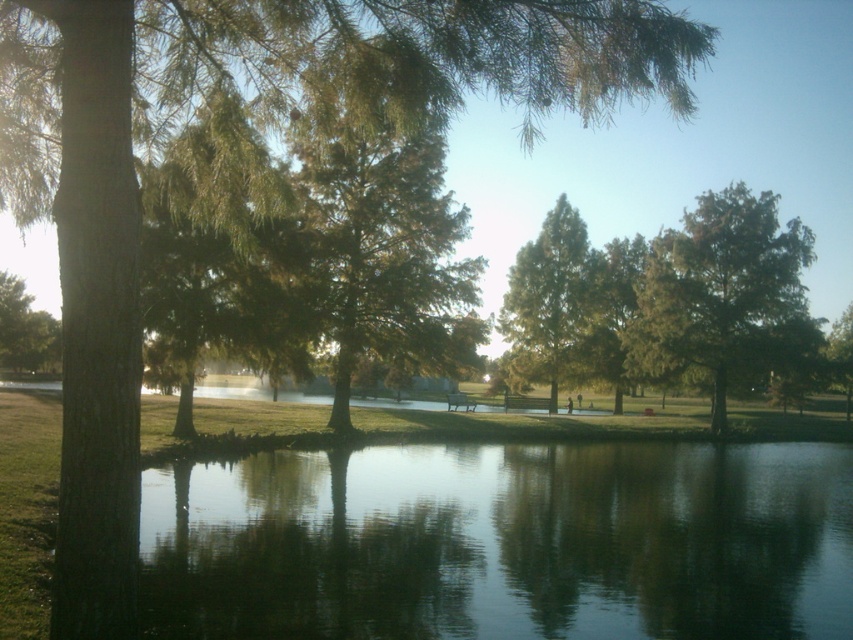
Question: Is green matte tree at center to the left of green leafy tree at left from the viewer's perspective?

Choices:
 (A) yes
 (B) no

Answer: (B)

Question: Is green matte tree at center further to camera compared to green leafy tree at left?

Choices:
 (A) yes
 (B) no

Answer: (A)

Question: Which of the following is the farthest from the observer?

Choices:
 (A) green leafy tree at left
 (B) green matte tree at center
 (C) green reflective water at center
 (D) green leafy tree at upper right

Answer: (B)

Question: Which point is closer to the camera taking this photo?

Choices:
 (A) (234, 579)
 (B) (582, 291)
 (C) (714, 419)

Answer: (A)

Question: Does green reflective water at center have a smaller size compared to green leafy tree at upper right?

Choices:
 (A) yes
 (B) no

Answer: (A)

Question: Which of these objects is positioned closest to the green leafy tree at upper right?

Choices:
 (A) green matte tree at center
 (B) green reflective water at center
 (C) green leafy tree at left

Answer: (A)